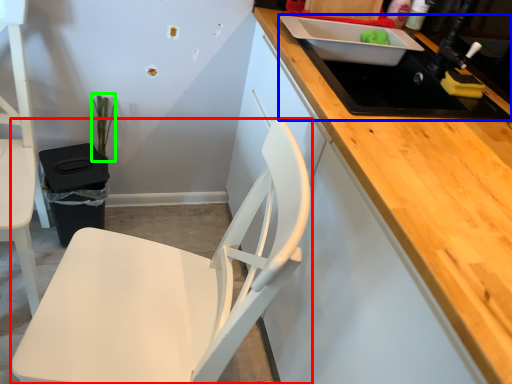
Question: Which object is the closest to the chair (highlighted by a red box)? Choose among these: sink (highlighted by a blue box) or plant (highlighted by a green box).

Choices:
 (A) sink
 (B) plant

Answer: (A)